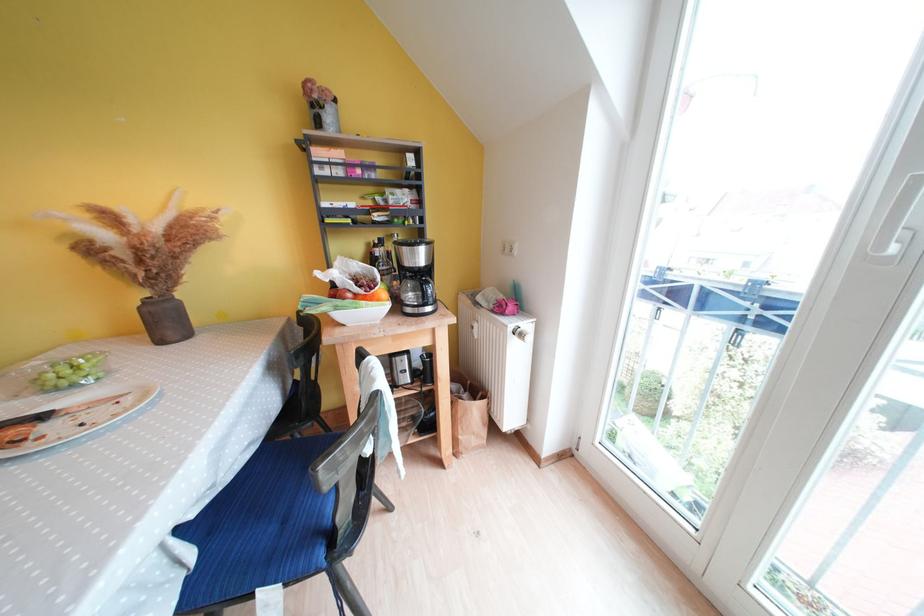
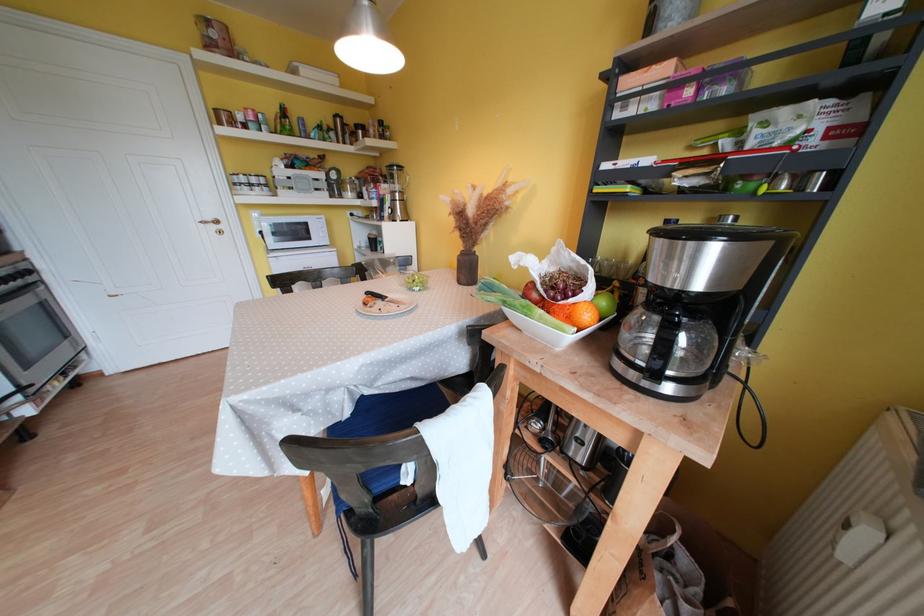
Find the pixel in the second image that matches pixel 174 329 in the first image.

(472, 275)